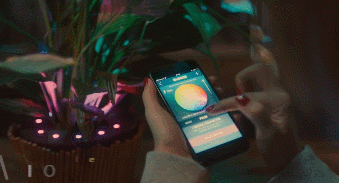
You are a GUI agent. You are given a task and a screenshot of the screen. Output one action in this format:
    pyautogui.click(x=<x>, y=<y>)
    Task: Click on the light
    Image resolution: width=339 pixels, height=183 pixels.
    Given the screenshot: What is the action you would take?
    coord(131,115)